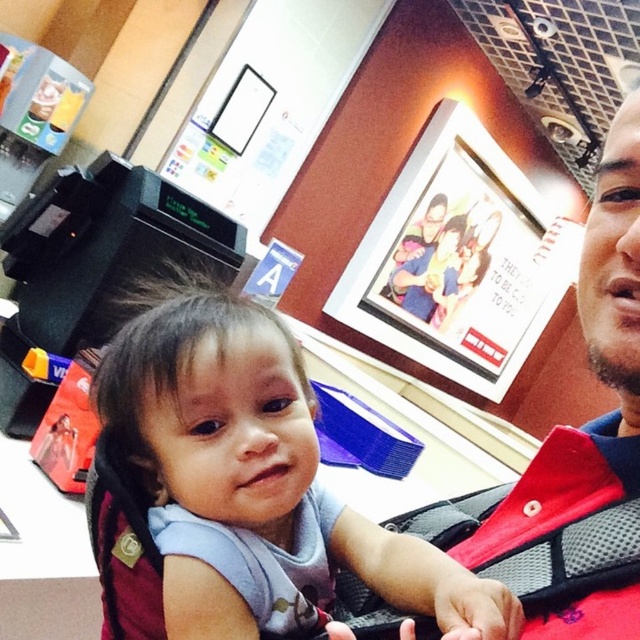
You are a photographer setting up for a group photo. You notice the smooth blue bib at center and the matte red shirt at upper right in your frame. Which object should you adjust to ensure both are centered properly?

The smooth blue bib at center is to the left of the matte red shirt at upper right, so you should move the smooth blue bib at center to the right or the matte red shirt at upper right to the left to center both objects.